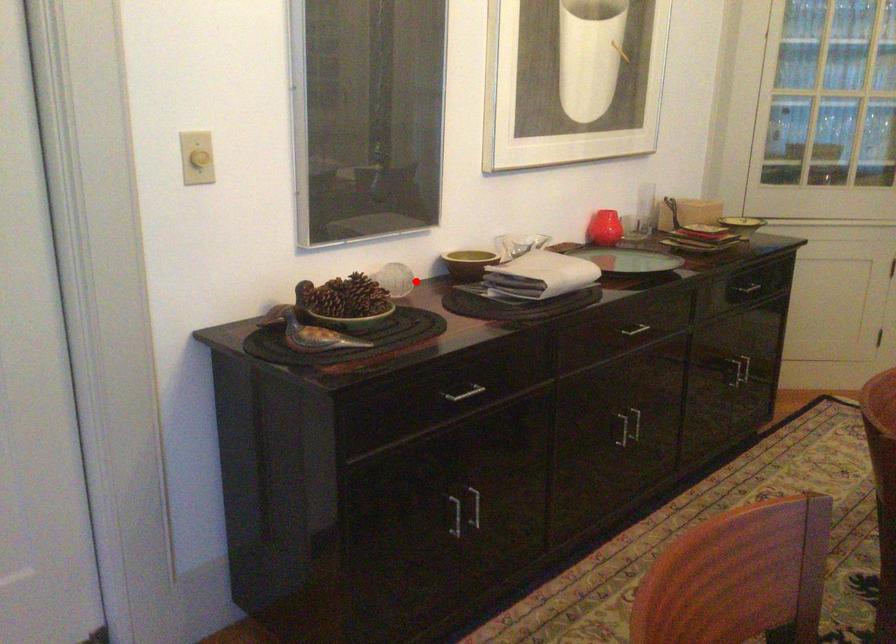
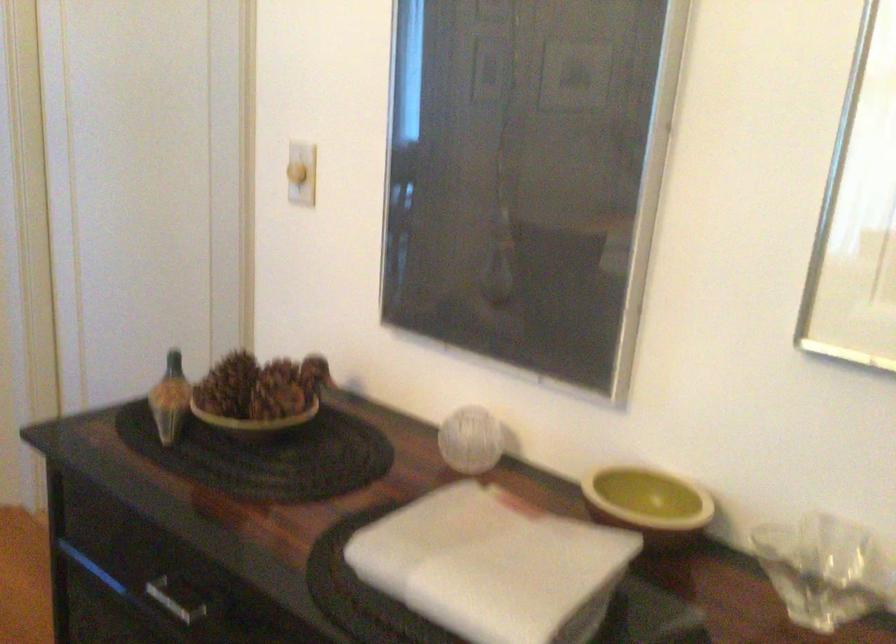
Find the pixel in the second image that matches the highlighted location in the first image.

(470, 440)